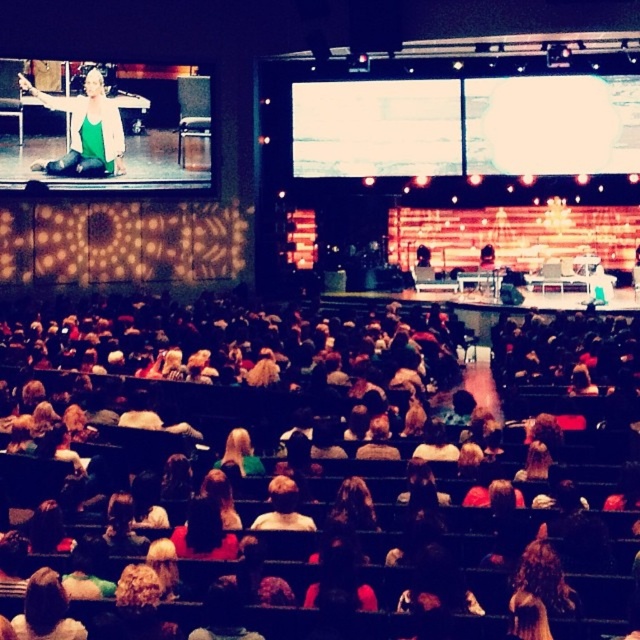
You are an event photographer trying to capture a clear shot of the speaker. You notice the green matte tank top at upper left and the blonde hair at center in your viewfinder. Based on their positions, which object might block your view of the other?

The green matte tank top at upper left might block the view of the blonde hair at center because it is wider than the blonde hair at center.

You are an attendee sitting in the front row of the auditorium. You notice the green matte tank top at upper left and the blonde hair at center on stage. Which of these two items is closer to you?

The green matte tank top at upper left is closer to you because it is further to the viewer than the blonde hair at center.

You are standing in the front row of the auditorium and want to locate the green matte tank top at upper left. Based on the coordinates provided, where should you look relative to the stage?

The green matte tank top at upper left is located at the coordinates point (84,131), which is on the left side of the stage near the upper area.